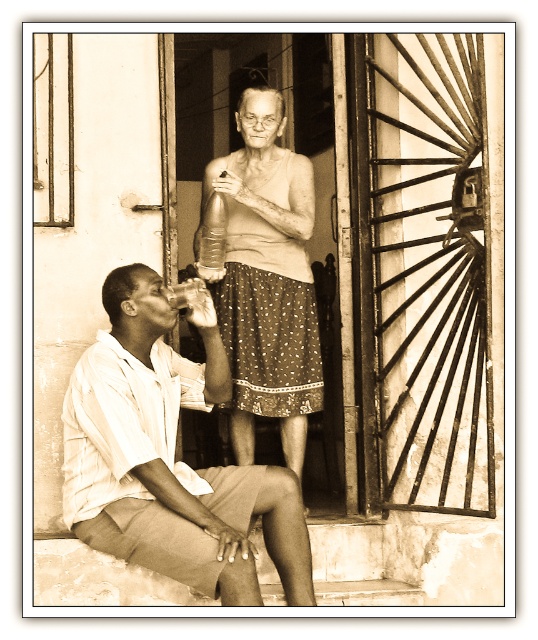
You are at a vintage event and need to pour the translucent glass drink at center into the metallic silver bottle at upper center. Will the bottle hold all the drink?

The metallic silver bottle at upper center is bigger than the translucent glass drink at center, so yes, the bottle can hold all the drink.

Looking at this image, based on the coordinates provided in the scene, where is the white cotton shirt at lower left located?

The white cotton shirt at lower left is located at point 0.716 on the x axis and 0.316 on the y axis.